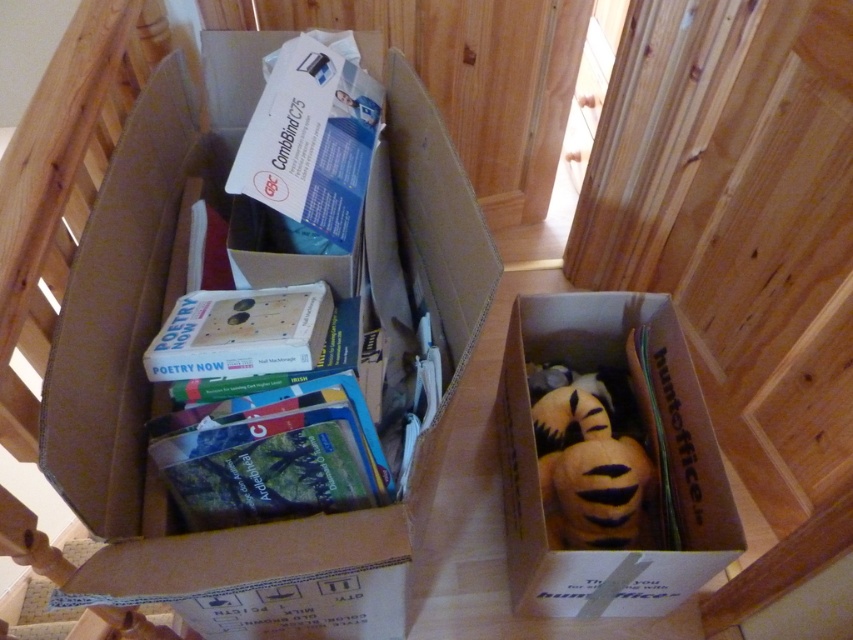
You are holding a camera and want to take a photo of the brown cardboard box at center. If your camera can focus on objects up to 60 centimeters away, will it be able to capture a clear image of the box?

The brown cardboard box at center and camera are 58.60 centimeters apart from each other. Since the camera can focus up to 60 centimeters, it will be able to capture a clear image of the box as the distance is within the focus range.

You are standing in a room with two cardboard boxes. One contains books and a box labeled GBC, and the other has a plush bear toy. A point at coordinates (343, 444) is 30.04 inches away from you. If you want to reach that point, which box should you move towards?

The point at coordinates (343, 444) is 30.04 inches from you, so you should move towards the box that contains the plush bear toy because the point is closer to that box.

You are organizing a bookshelf and need to place the hardcover book at center. Where exactly should you place it on the shelf?

The hardcover book at center should be placed at the coordinates point (271, 454).